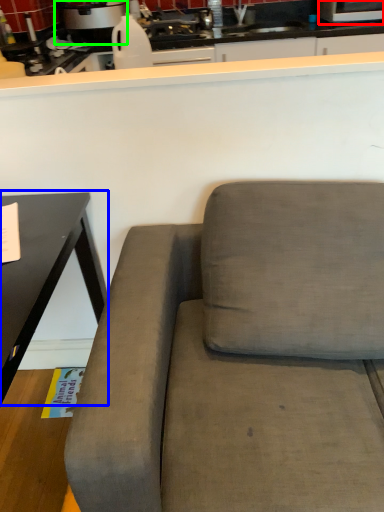
Question: Which object is the farthest from appliance (highlighted by a red box)? Choose among these: table (highlighted by a blue box) or appliance (highlighted by a green box).

Choices:
 (A) table
 (B) appliance

Answer: (A)